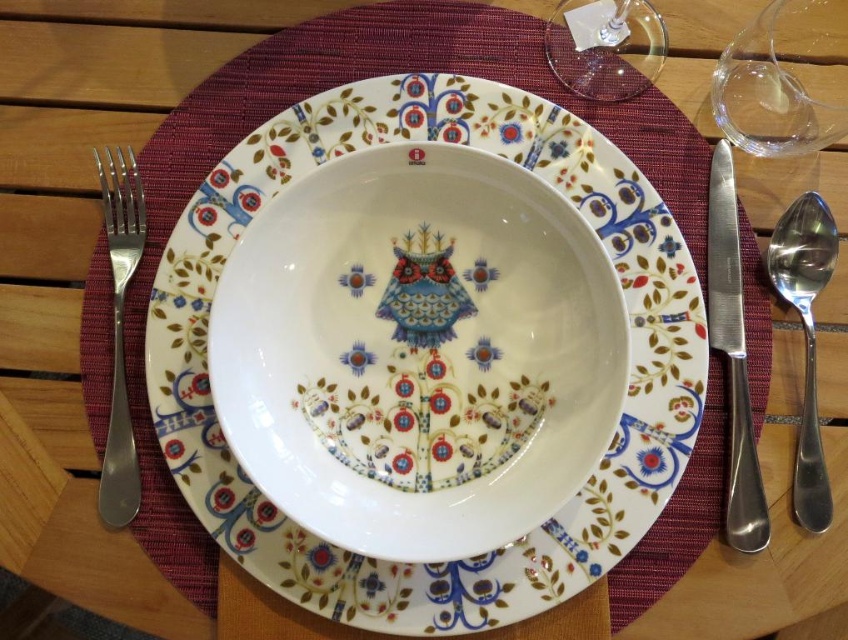
You are arranging a table setting and need to place a napkin. The satin silver knife at right is currently at position coordinates 0.559, 0.864. Where should you place the napkin so it doesn

The satin silver knife at right is located at coordinates (732, 356). To place the napkin appropriately, position it near the center of the table, away from the knife to avoid clutter.

You are looking at the table setting and want to place a napkin between the two points, point (746, 51) and point (561, 65). Which point should you start folding the napkin closer to the viewer?

You should start folding the napkin closer to point (746, 51) because it is closer to the viewer than point (561, 65).

You are setting up a table and need to place a napkin between the satin silver fork at left and the transparent glass wine glass at upper center. Based on their positions, where should you place the napkin?

The satin silver fork at left is to the left of the transparent glass wine glass at upper center, so you should place the napkin between them on the left side of the wine glass and right side of the fork.